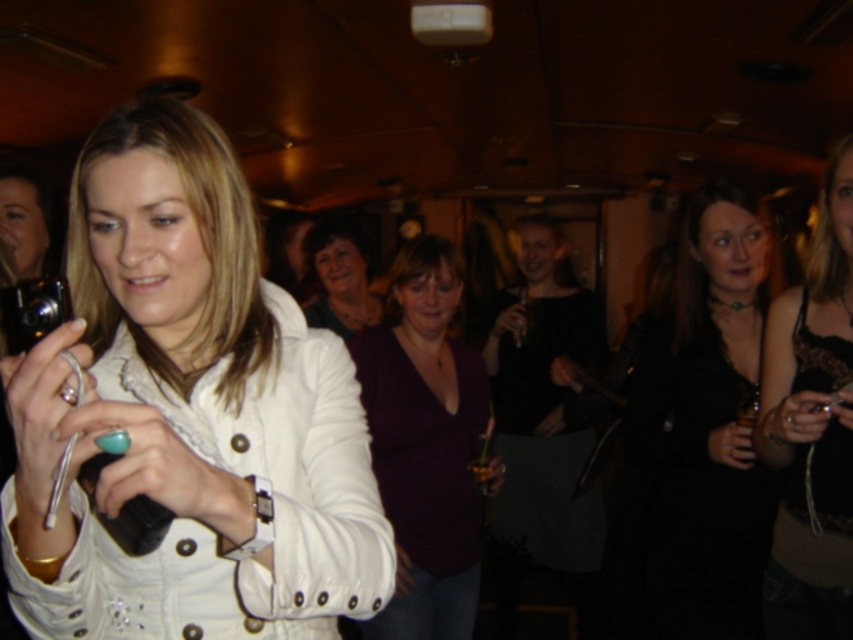
Question: Does purple matte shirt at center appear under black lace tank top at center?

Choices:
 (A) yes
 (B) no

Answer: (A)

Question: Among these objects, which one is farthest from the camera?

Choices:
 (A) white leather jacket at center
 (B) black lace tank top at center

Answer: (B)

Question: Can you confirm if black satin dress at center is positioned above matte purple shirt at center?

Choices:
 (A) no
 (B) yes

Answer: (A)

Question: Which of the following is the closest to the observer?

Choices:
 (A) matte black camera at left
 (B) matte purple shirt at center

Answer: (A)

Question: Is black satin dress at center further to camera compared to matte black camera at left?

Choices:
 (A) no
 (B) yes

Answer: (A)

Question: Which of these objects is positioned closest to the white leather jacket at center?

Choices:
 (A) black satin dress at center
 (B) matte black camera at left
 (C) black lace tank top at center
 (D) matte purple shirt at center

Answer: (C)